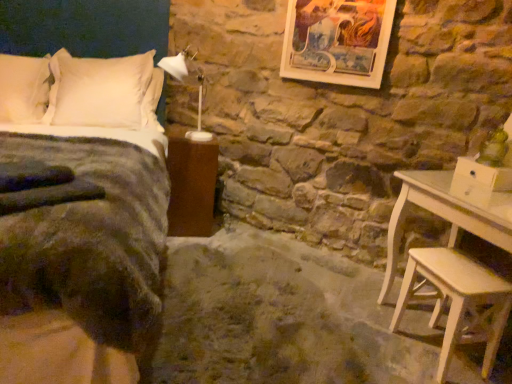
What are the coordinates of `free space that is to the left of light wood stool at lower right` in the screenshot? It's located at (378, 346).